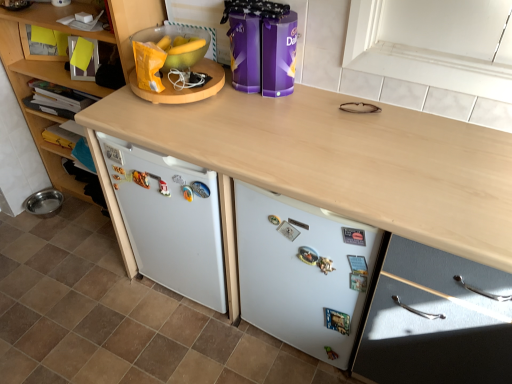
You are a GUI agent. You are given a task and a screenshot of the screen. Output one action in this format:
    pyautogui.click(x=<x>, y=<y>)
    Task: Click on the vacant space underneath purple glossy chocolate tins at center, positioned as the 1th appliance in right-to-left order (from a real-world perspective)
    The image size is (512, 384).
    Given the screenshot: What is the action you would take?
    pyautogui.click(x=260, y=96)